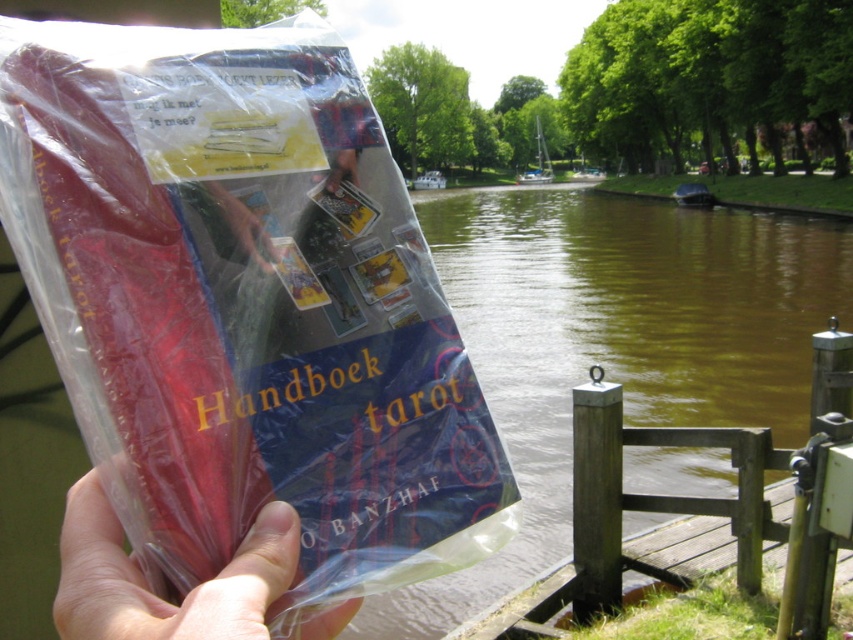
Question: Does transparent plastic bag at center appear over matte plastic hand at center?

Choices:
 (A) no
 (B) yes

Answer: (B)

Question: Does transparent plastic bag at center appear under matte plastic hand at center?

Choices:
 (A) yes
 (B) no

Answer: (B)

Question: Can you confirm if transparent plastic bag at center is positioned above matte plastic hand at center?

Choices:
 (A) no
 (B) yes

Answer: (B)

Question: Which point is farther to the camera?

Choices:
 (A) transparent plastic bag at center
 (B) matte plastic hand at center

Answer: (A)

Question: Among these objects, which one is farthest from the camera?

Choices:
 (A) matte plastic hand at center
 (B) transparent plastic bag at center

Answer: (B)